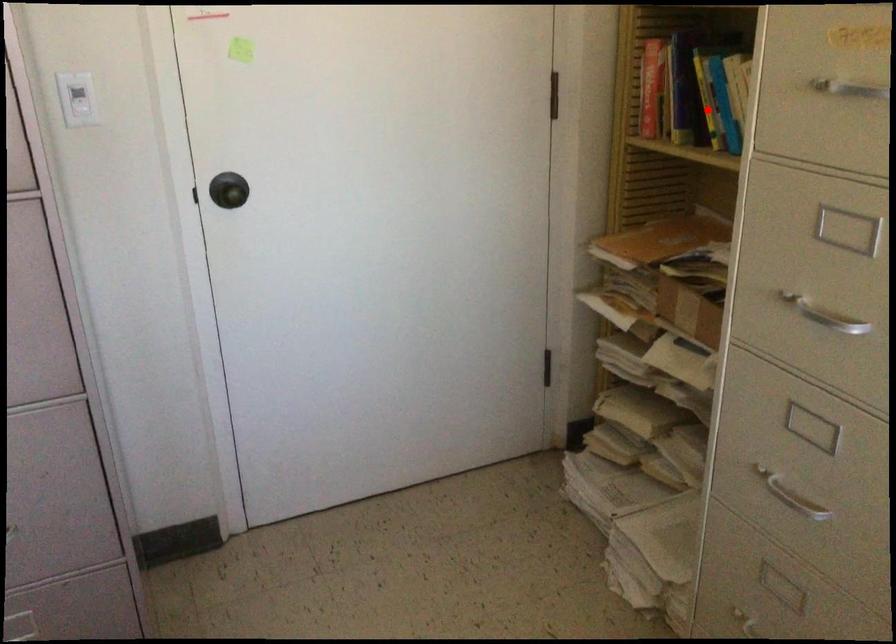
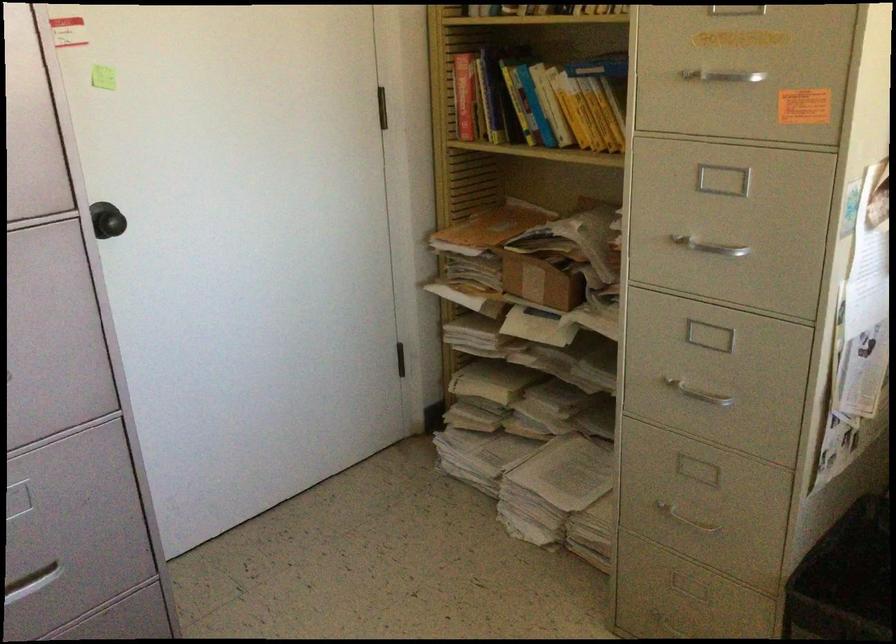
Question: I am providing you with two images of the same scene from different viewpoints. A red point is marked on the first image. At the location where the point appears in image 1, is it still visible in image 2?

Choices:
 (A) Yes
 (B) No

Answer: (A)